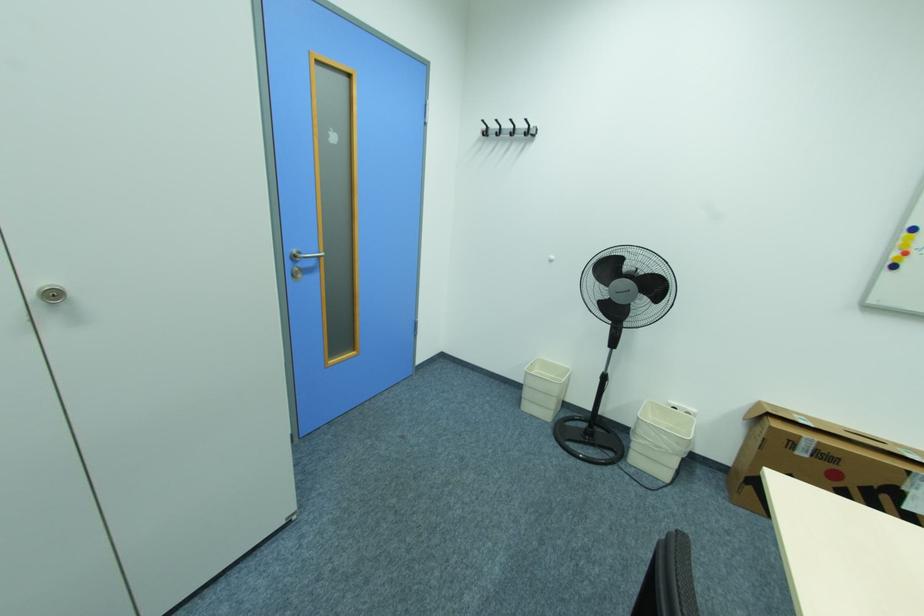
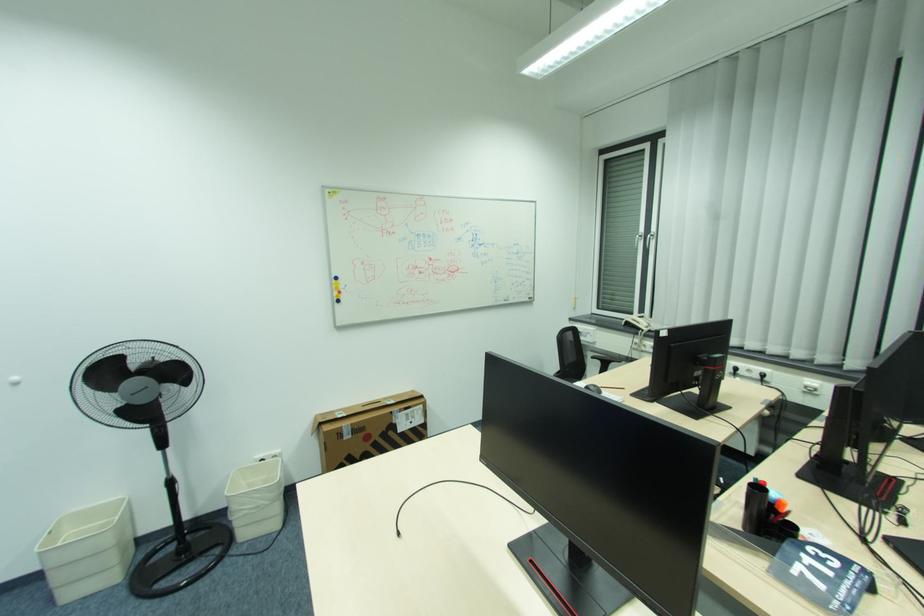
Question: I am providing you with two images of the same scene from different viewpoints. Please identify which objects are invisible in image2.

Choices:
 (A) chair armrest
 (B) red whiteboard magnet
 (C) fan control button
 (D) none of these

Answer: (D)